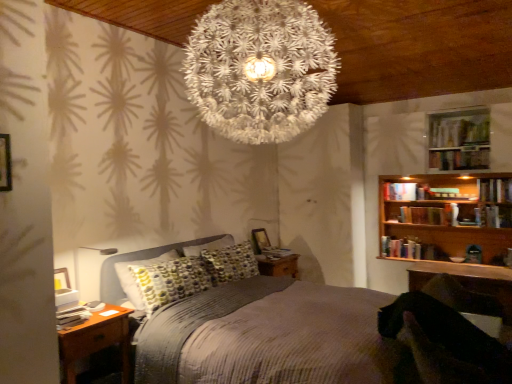
This screenshot has height=384, width=512. What do you see at coordinates (460, 159) in the screenshot? I see `hardcover book at upper right, the first book when ordered from top to bottom` at bounding box center [460, 159].

You are a GUI agent. You are given a task and a screenshot of the screen. Output one action in this format:
    pyautogui.click(x=<x>, y=<y>)
    Task: Click on the matte gray plastic table lamp at lower left
    
    Given the screenshot: What is the action you would take?
    tap(96, 257)

Measure the distance between hardcover books at right, which is the second book from bottom to top, and camera.

15.24 feet.

What are the coordinates of `hardcover book at upper right, the fifth book positioned from the right` in the screenshot? It's located at (400, 191).

The image size is (512, 384). Find the location of `brown wood nightstand at lower left`. brown wood nightstand at lower left is located at coordinates (96, 340).

Can you confirm if white paper-like at center is smaller than hardcover book at upper right, the sixth book in the bottom-to-top sequence?

No.

Between white paper-like at center and hardcover book at upper right, the 5th book when ordered from left to right, which one has more height?

Standing taller between the two is white paper-like at center.

From the image's perspective, is white paper-like at center above or below hardcover book at upper right, the first book when ordered from top to bottom?

white paper-like at center is situated higher than hardcover book at upper right, the first book when ordered from top to bottom, in the image.

Is hardcover book at upper right, the sixth book in the bottom-to-top sequence, located outside brown wood nightstand at lower left?

Yes, hardcover book at upper right, the sixth book in the bottom-to-top sequence, is not within brown wood nightstand at lower left.

From the picture: Which object is positioned more to the left, hardcover book at upper right, the 5th book when ordered from left to right, or brown wood nightstand at lower left?

Positioned to the left is brown wood nightstand at lower left.

What's the angular difference between hardcover book at upper right, the 5th book when ordered from left to right, and brown wood nightstand at lower left's facing directions?

90.2 degrees.

From a real-world perspective, is hardcover book at upper right, which ranks as the second book in right-to-left order, positioned over brown wood nightstand at lower left based on gravity?

Correct, in the physical world, hardcover book at upper right, which ranks as the second book in right-to-left order, is higher than brown wood nightstand at lower left.

Is white paper-like at center positioned with its back to hardcover book at center, which ranks as the sixth book in right-to-left order?

No, white paper-like at center is not facing the opposite direction of hardcover book at center, which ranks as the sixth book in right-to-left order.

From the image's perspective, which one is positioned higher, white paper-like at center or hardcover book at center, which ranks as the sixth book in right-to-left order?

From the image's view, white paper-like at center is above.

Measure the distance between white paper-like at center and hardcover book at center, which ranks as the sixth book in right-to-left order.

white paper-like at center is 8.64 feet from hardcover book at center, which ranks as the sixth book in right-to-left order.

From a real-world perspective, is hardcover book at center, which appears as the sixth book when viewed from the top, positioned above or below hardcover book at upper right, arranged as the fourth book when viewed from the top?

In terms of real-world spatial position, hardcover book at center, which appears as the sixth book when viewed from the top, is below hardcover book at upper right, arranged as the fourth book when viewed from the top.

Are hardcover book at center, which appears as the sixth book when viewed from the top, and hardcover book at upper right, the fourth book in the left-to-right sequence, far apart?

Absolutely, hardcover book at center, which appears as the sixth book when viewed from the top, is distant from hardcover book at upper right, the fourth book in the left-to-right sequence.

Identify the location of the 2nd book below when counting from the hardcover book at upper right, arranged as the fourth book when viewed from the top (from the image's perspective). Image resolution: width=512 pixels, height=384 pixels. (276, 252).

Considering the relative positions of hardcover book at center, which appears as the 1th book when viewed from the left, and hardcover book at upper right, which appears as the third book when ordered from the bottom, in the image provided, is hardcover book at center, which appears as the 1th book when viewed from the left, to the left or to the right of hardcover book at upper right, which appears as the third book when ordered from the bottom,?

In the image, hardcover book at center, which appears as the 1th book when viewed from the left, appears on the left side of hardcover book at upper right, which appears as the third book when ordered from the bottom.

Which is behind, wooden bookshelf at upper right or hardcover book at upper right, the sixth book in the left-to-right sequence?

wooden bookshelf at upper right is further away from the camera.

From a real-world perspective, is wooden bookshelf at upper right below hardcover book at upper right, the second book positioned from the top?

Yes, from a real-world perspective, wooden bookshelf at upper right is below hardcover book at upper right, the second book positioned from the top.

Based on the photo, considering the sizes of objects wooden bookshelf at upper right and hardcover book at upper right, the sixth book in the left-to-right sequence, in the image provided, who is thinner, wooden bookshelf at upper right or hardcover book at upper right, the sixth book in the left-to-right sequence,?

hardcover book at upper right, the sixth book in the left-to-right sequence, is thinner.

From the image's perspective, is wooden bookshelf at upper right above or below hardcover book at upper right, the sixth book in the left-to-right sequence?

From the image's perspective, wooden bookshelf at upper right appears below hardcover book at upper right, the sixth book in the left-to-right sequence.

How many degrees apart are the facing directions of wooden bookshelf at upper right and white paper-like at center?

0.0865 degrees.

Where is `bookcase lying on the right of white paper-like at center`? The image size is (512, 384). bookcase lying on the right of white paper-like at center is located at coordinates (445, 215).

Is wooden bookshelf at upper right located outside white paper-like at center?

Yes, wooden bookshelf at upper right is located beyond the bounds of white paper-like at center.

From the image's perspective, which is below, wooden bookshelf at upper right or white paper-like at center?

wooden bookshelf at upper right is shown below in the image.

Locate an element on the screen. The width and height of the screenshot is (512, 384). book behind the hardcover books at right, which is counted as the fifth book, starting from the top is located at coordinates (400, 191).

Based on the photo, from the image's perspective, is hardcover book at upper right, acting as the fourth book starting from the bottom, below hardcover books at right, marked as the fourth book in a right-to-left arrangement?

Actually, hardcover book at upper right, acting as the fourth book starting from the bottom, appears above hardcover books at right, marked as the fourth book in a right-to-left arrangement, in the image.

In the scene shown: Is hardcover books at right, marked as the fourth book in a right-to-left arrangement, located within hardcover book at upper right, which is the 3th book in top-to-bottom order?

No, hardcover book at upper right, which is the 3th book in top-to-bottom order, does not contain hardcover books at right, marked as the fourth book in a right-to-left arrangement.

From a real-world perspective, between hardcover book at upper right, which is the 3th book in top-to-bottom order, and hardcover books at right, which is counted as the fifth book, starting from the top, who is vertically higher?

hardcover book at upper right, which is the 3th book in top-to-bottom order, is physically above.

Image resolution: width=512 pixels, height=384 pixels. What are the coordinates of `christmas light above the hardcover book at upper right, the first book when ordered from top to bottom (from a real-world perspective)` in the screenshot? It's located at (260, 69).

Identify the location of nightstand that is on the left side of hardcover book at upper right, which ranks as the second book in right-to-left order. Image resolution: width=512 pixels, height=384 pixels. (96, 340).

Looking at the image, which one is located further to hardcover book at upper right, the sixth book in the left-to-right sequence, wooden table at lower right or brown wood nightstand at lower left?

Among the two, brown wood nightstand at lower left is located further to hardcover book at upper right, the sixth book in the left-to-right sequence.

Based on their spatial positions, is wooden table at lower right or hardcover book at upper right, the fifth book positioned from the right, closer to wooden bookshelf at upper right?

The object closer to wooden bookshelf at upper right is hardcover book at upper right, the fifth book positioned from the right.

Considering their positions, is textured gray bed at center positioned closer to brown wood nightstand at lower left than wooden bookshelf at upper right?

textured gray bed at center is positioned closer to the anchor brown wood nightstand at lower left.

From the image, which object appears to be nearer to hardcover books at right, which is the second book from bottom to top, textured gray bed at center or hardcover book at upper right, the sixth book in the bottom-to-top sequence?

Based on the image, hardcover book at upper right, the sixth book in the bottom-to-top sequence, appears to be nearer to hardcover books at right, which is the second book from bottom to top.

Based on their spatial positions, is hardcover book at upper right, arranged as the fourth book when viewed from the top, or hardcover book at upper right, the sixth book in the bottom-to-top sequence, closer to brown wood nightstand at lower left?

hardcover book at upper right, arranged as the fourth book when viewed from the top, is positioned closer to the anchor brown wood nightstand at lower left.

Looking at the image, which one is located further to hardcover book at upper right, the sixth book in the left-to-right sequence, hardcover book at upper right, the first book when ordered from top to bottom, or wooden bookshelf at upper right?

wooden bookshelf at upper right is positioned further to the anchor hardcover book at upper right, the sixth book in the left-to-right sequence.

Looking at the image, which one is located further to matte gray plastic table lamp at lower left, hardcover books at right, marked as the fourth book in a right-to-left arrangement, or hardcover book at upper right, the fifth book positioned from the right?

hardcover books at right, marked as the fourth book in a right-to-left arrangement, is positioned further to the anchor matte gray plastic table lamp at lower left.

Considering their positions, is brown wood nightstand at lower left positioned closer to hardcover book at upper right, the sixth book in the left-to-right sequence, than wooden bookshelf at upper right?

wooden bookshelf at upper right is positioned closer to the anchor hardcover book at upper right, the sixth book in the left-to-right sequence.

The width and height of the screenshot is (512, 384). I want to click on table lamp between brown wood nightstand at lower left and hardcover book at upper right, which ranks as the second book in right-to-left order, so click(x=96, y=257).

Where is `table lamp between textured gray bed at center and hardcover book at upper right, the fifth book positioned from the right, along the z-axis`? The image size is (512, 384). table lamp between textured gray bed at center and hardcover book at upper right, the fifth book positioned from the right, along the z-axis is located at coordinates (96, 257).

The image size is (512, 384). I want to click on table lamp between brown wood nightstand at lower left and hardcover book at upper right, which is the 3th book in top-to-bottom order, so click(x=96, y=257).

Where is `table lamp between brown wood nightstand at lower left and hardcover book at upper right, which is the first book from right to left, in the horizontal direction`? This screenshot has height=384, width=512. table lamp between brown wood nightstand at lower left and hardcover book at upper right, which is the first book from right to left, in the horizontal direction is located at coordinates (96, 257).